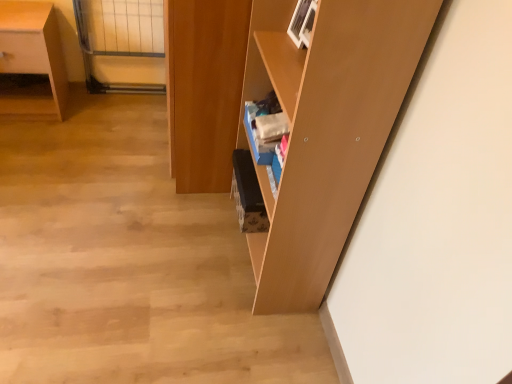
You are a GUI agent. You are given a task and a screenshot of the screen. Output one action in this format:
    pyautogui.click(x=<x>, y=<y>)
    Task: Click on the vacant space in front of matte wood shelf at center
    
    Given the screenshot: What is the action you would take?
    pyautogui.click(x=232, y=329)